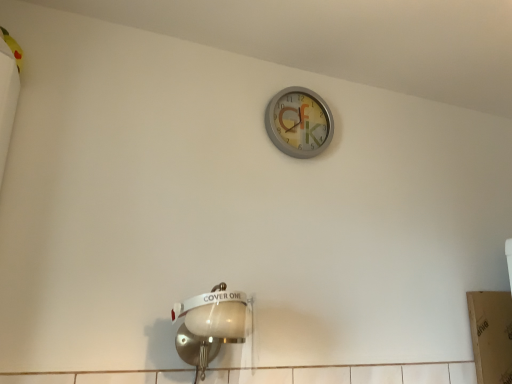
Measure the distance between point (313, 93) and camera.

Point (313, 93) and camera are 5.21 feet apart.

Where is `metallic silver clock at upper center`? The width and height of the screenshot is (512, 384). metallic silver clock at upper center is located at coordinates (298, 122).

Image resolution: width=512 pixels, height=384 pixels. What do you see at coordinates (298, 122) in the screenshot?
I see `metallic silver clock at upper center` at bounding box center [298, 122].

What do you see at coordinates (209, 325) in the screenshot?
I see `white glossy light fixture at lower left` at bounding box center [209, 325].

This screenshot has width=512, height=384. Find the location of `white glossy light fixture at lower left`. white glossy light fixture at lower left is located at coordinates (209, 325).

I want to click on metallic silver clock at upper center, so click(298, 122).

Visually, is white glossy light fixture at lower left positioned to the left or to the right of metallic silver clock at upper center?

Based on their positions, white glossy light fixture at lower left is located to the left of metallic silver clock at upper center.

In the image, is white glossy light fixture at lower left positioned in front of or behind metallic silver clock at upper center?

white glossy light fixture at lower left is in front of metallic silver clock at upper center.

Which point is more distant from viewer, (x=219, y=305) or (x=296, y=127)?

The point (x=296, y=127) is more distant.

From the image's perspective, between white glossy light fixture at lower left and metallic silver clock at upper center, who is located below?

white glossy light fixture at lower left.

From the picture: From a real-world perspective, is white glossy light fixture at lower left below metallic silver clock at upper center?

Yes, from a real-world perspective, white glossy light fixture at lower left is under metallic silver clock at upper center.

Does white glossy light fixture at lower left have a lesser width compared to metallic silver clock at upper center?

No, white glossy light fixture at lower left is not thinner than metallic silver clock at upper center.

Does white glossy light fixture at lower left have a lesser height compared to metallic silver clock at upper center?

Incorrect, the height of white glossy light fixture at lower left does not fall short of that of metallic silver clock at upper center.

Looking at the image, does white glossy light fixture at lower left seem bigger or smaller compared to metallic silver clock at upper center?

white glossy light fixture at lower left is bigger than metallic silver clock at upper center.

Choose the correct answer: Is white glossy light fixture at lower left inside metallic silver clock at upper center or outside it?

white glossy light fixture at lower left is not inside metallic silver clock at upper center, it's outside.

Is white glossy light fixture at lower left in contact with metallic silver clock at upper center?

No, white glossy light fixture at lower left is not beside metallic silver clock at upper center.

Is white glossy light fixture at lower left oriented towards metallic silver clock at upper center?

No, white glossy light fixture at lower left is not turned towards metallic silver clock at upper center.

How different are the orientations of white glossy light fixture at lower left and metallic silver clock at upper center in degrees?

They differ by 1.42 degrees in their facing directions.

Identify the location of wall clock behind the white glossy light fixture at lower left. Image resolution: width=512 pixels, height=384 pixels. (298, 122).

Which is more to the right, metallic silver clock at upper center or white glossy light fixture at lower left?

From the viewer's perspective, metallic silver clock at upper center appears more on the right side.

Does metallic silver clock at upper center come in front of white glossy light fixture at lower left?

That is False.

Is point (302, 154) more distant than point (191, 313)?

Yes.

From the image's perspective, which object appears higher, metallic silver clock at upper center or white glossy light fixture at lower left?

metallic silver clock at upper center.

From a real-world perspective, is metallic silver clock at upper center under white glossy light fixture at lower left?

No.

Does metallic silver clock at upper center have a lesser width compared to white glossy light fixture at lower left?

Yes.

Which of these two, metallic silver clock at upper center or white glossy light fixture at lower left, stands taller?

With more height is white glossy light fixture at lower left.

Can you confirm if metallic silver clock at upper center is smaller than white glossy light fixture at lower left?

Yes.

Is metallic silver clock at upper center outside of white glossy light fixture at lower left?

Absolutely, metallic silver clock at upper center is external to white glossy light fixture at lower left.

Is metallic silver clock at upper center far from white glossy light fixture at lower left?

No, there isn't a large distance between metallic silver clock at upper center and white glossy light fixture at lower left.

Is metallic silver clock at upper center positioned with its back to white glossy light fixture at lower left?

metallic silver clock at upper center is not turned away from white glossy light fixture at lower left.

How far apart are metallic silver clock at upper center and white glossy light fixture at lower left?

metallic silver clock at upper center is 25.70 inches away from white glossy light fixture at lower left.

Locate an element on the screen. This screenshot has width=512, height=384. wall clock above the white glossy light fixture at lower left (from the image's perspective) is located at coordinates (298, 122).

The image size is (512, 384). I want to click on wall clock on the right of white glossy light fixture at lower left, so click(x=298, y=122).

Find the location of a particular element. This screenshot has height=384, width=512. light fixture that appears below the metallic silver clock at upper center (from a real-world perspective) is located at coordinates (209, 325).